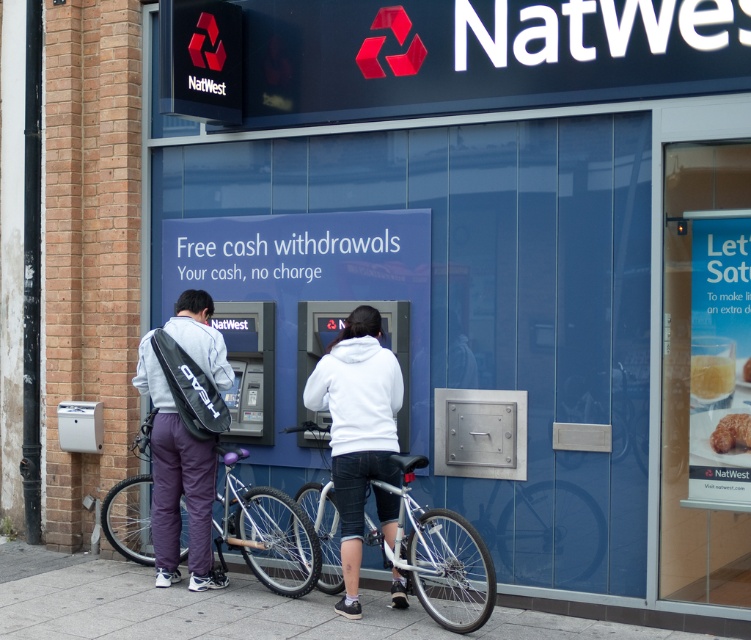
Question: Which object appears farthest from the camera in this image?

Choices:
 (A) white matte hoodie at center
 (B) purple matte bicycle at center

Answer: (B)

Question: Which object is the farthest from the gray fabric backpack at lower left?

Choices:
 (A) silver metallic bicycle at center
 (B) golden crispy croissant at center
 (C) gray fabric backpack at center

Answer: (B)

Question: Which of these objects is positioned farthest from the gray fabric backpack at lower left?

Choices:
 (A) gray fabric backpack at center
 (B) purple matte bicycle at center
 (C) golden crispy bread at center

Answer: (C)

Question: Is gray concrete pavement at lower center closer to the viewer compared to silver metallic bicycle at center?

Choices:
 (A) yes
 (B) no

Answer: (B)

Question: Is silver metallic bicycle at center behind gray fabric backpack at center?

Choices:
 (A) no
 (B) yes

Answer: (A)

Question: Does gray concrete pavement at lower center appear on the right side of golden crispy bread at center?

Choices:
 (A) yes
 (B) no

Answer: (B)